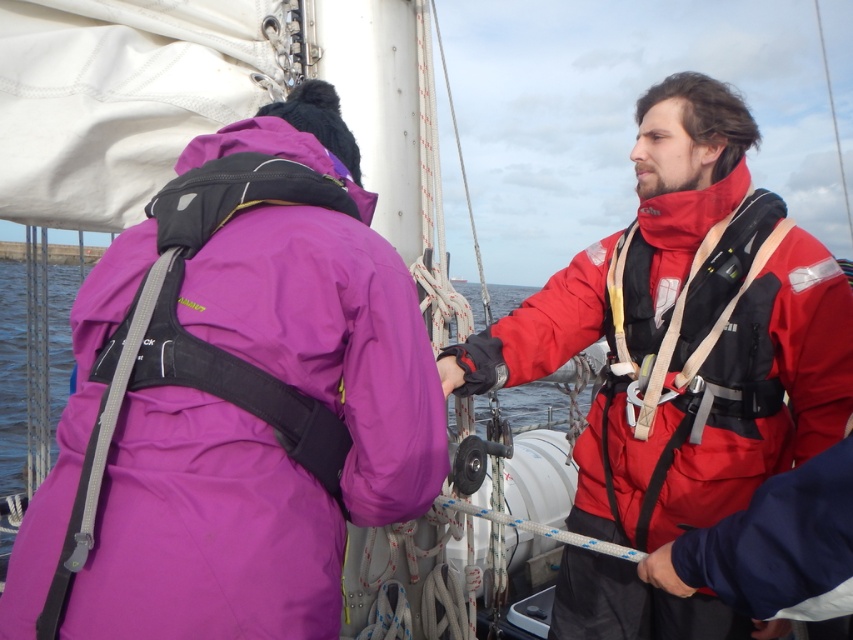
Question: Does red matte life vest at center have a lesser width compared to transparent water at center?

Choices:
 (A) no
 (B) yes

Answer: (B)

Question: Considering the real-world distances, which object is farthest from the transparent water at center?

Choices:
 (A) purple matte jacket at upper left
 (B) red matte life vest at center

Answer: (B)

Question: Can you confirm if purple matte jacket at upper left is smaller than transparent water at center?

Choices:
 (A) yes
 (B) no

Answer: (A)

Question: From the image, what is the correct spatial relationship of red matte life vest at center in relation to transparent water at center?

Choices:
 (A) below
 (B) above

Answer: (A)

Question: Which object is closer to the camera taking this photo?

Choices:
 (A) purple matte jacket at upper left
 (B) red matte life vest at center
 (C) transparent water at center

Answer: (A)

Question: Which object is closer to the camera taking this photo?

Choices:
 (A) transparent water at center
 (B) red matte life vest at center

Answer: (B)